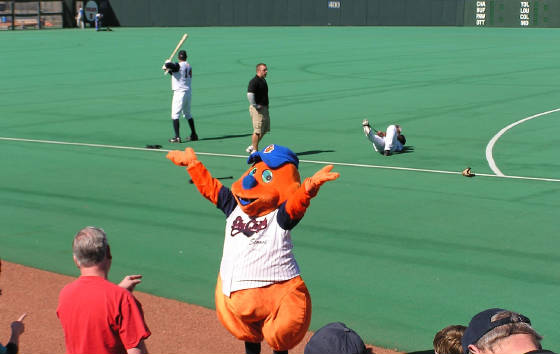
Image resolution: width=560 pixels, height=354 pixels. Find the location of `wall`. wall is located at coordinates [315, 12], [427, 14], [185, 15], [120, 14].